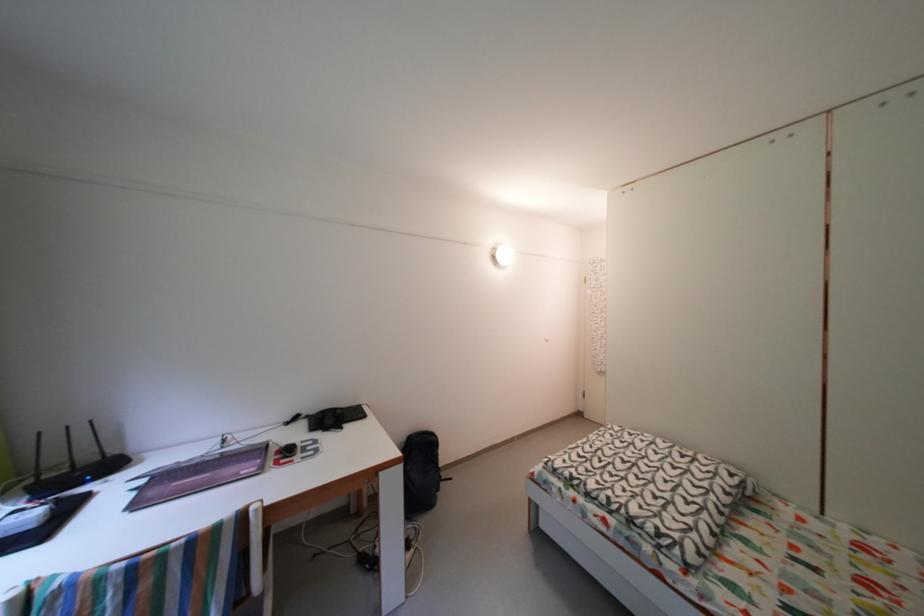
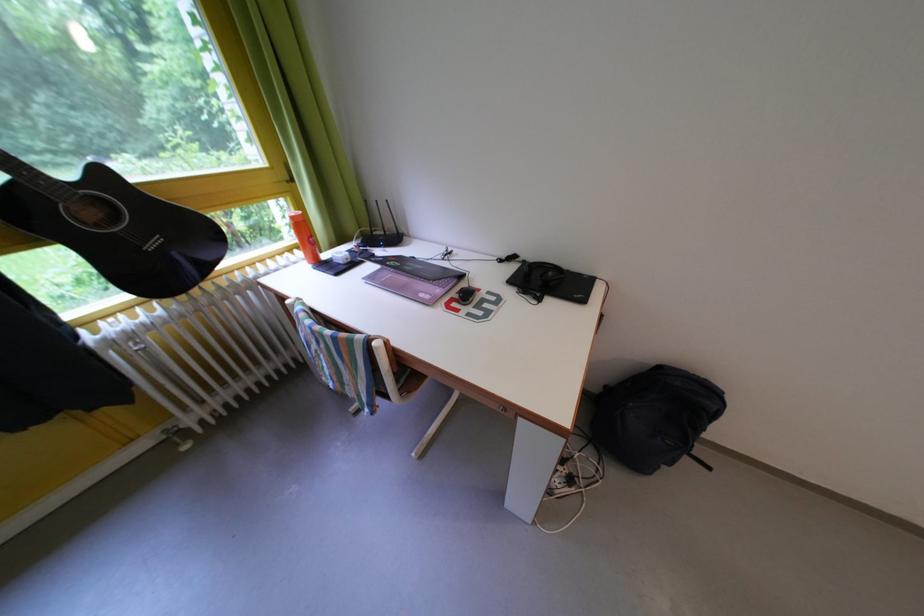
Where in the second image is the point corresponding to the point at 317,422 from the first image?

(533, 267)